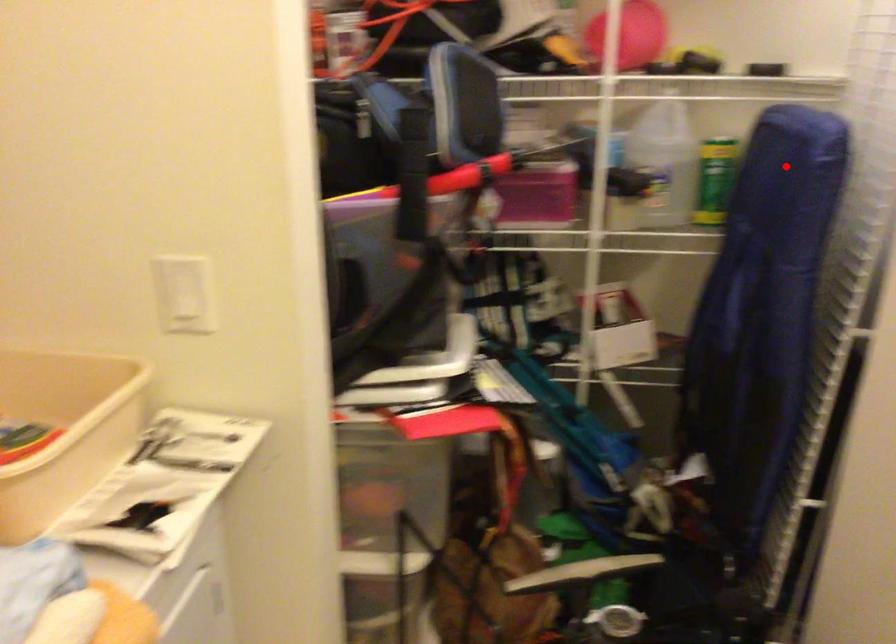
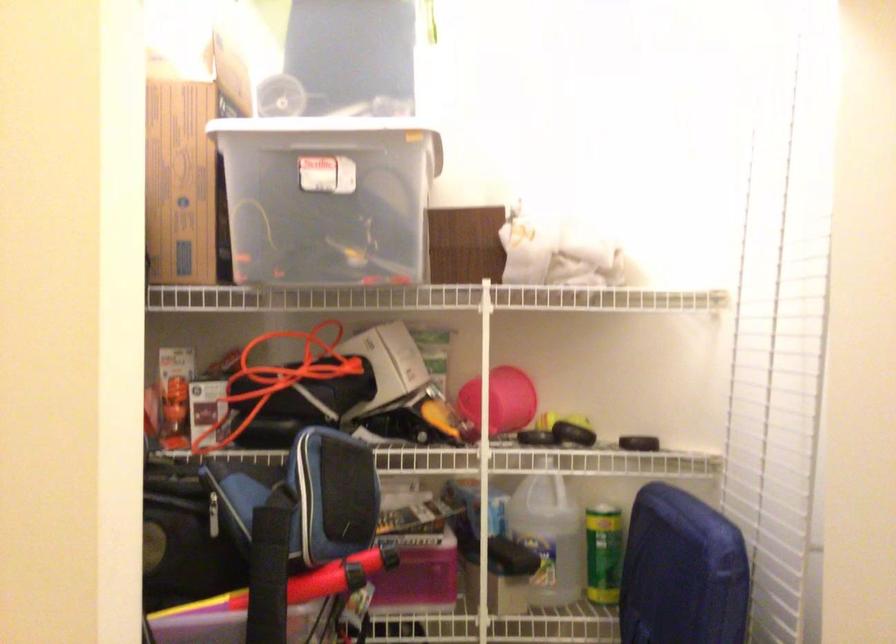
The point at the highlighted location is marked in the first image. Where is the corresponding point in the second image?

(682, 572)